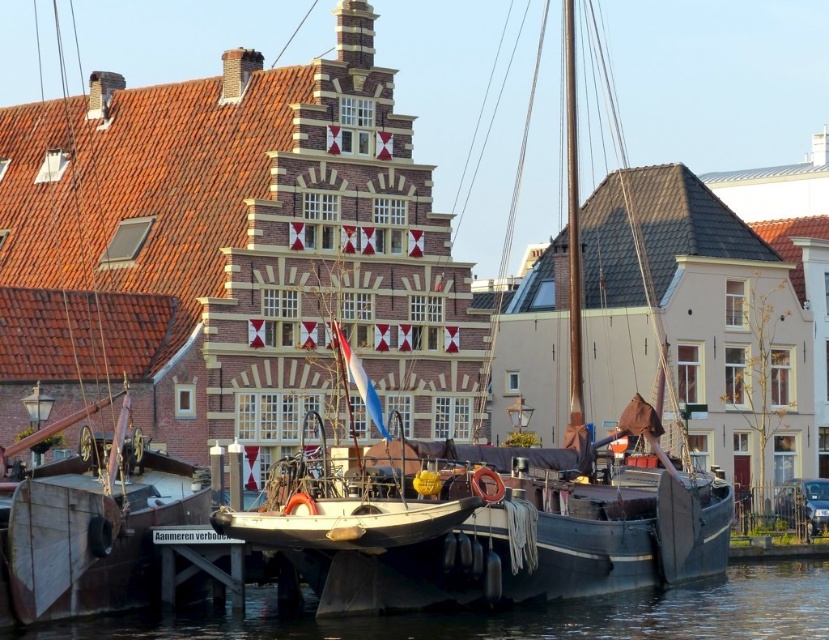
Is wooden boat at left positioned before transparent water at lower center?

Yes, it is in front of transparent water at lower center.

Can you confirm if wooden boat at left is wider than transparent water at lower center?

Incorrect, wooden boat at left's width does not surpass transparent water at lower center's.

Locate an element on the screen. wooden boat at left is located at coordinates (100, 330).

The height and width of the screenshot is (640, 829). Find the location of `wooden boat at left`. wooden boat at left is located at coordinates (100, 330).

What do you see at coordinates (100, 330) in the screenshot? The width and height of the screenshot is (829, 640). I see `wooden boat at left` at bounding box center [100, 330].

Based on the photo, can you confirm if wooden boat at left is positioned below wooden sailboat at center?

Correct, wooden boat at left is located below wooden sailboat at center.

Is point (148, 346) closer to viewer compared to point (667, 566)?

No, (148, 346) is further to viewer.

Locate an element on the screen. wooden boat at left is located at coordinates (x=100, y=330).

Is wooden sailboat at center taller than transparent water at lower center?

Indeed, wooden sailboat at center has a greater height compared to transparent water at lower center.

Does wooden sailboat at center have a lesser height compared to transparent water at lower center?

In fact, wooden sailboat at center may be taller than transparent water at lower center.

Locate an element on the screen. The width and height of the screenshot is (829, 640). wooden sailboat at center is located at coordinates (522, 499).

Where is `wooden sailboat at center`? This screenshot has height=640, width=829. wooden sailboat at center is located at coordinates (522, 499).